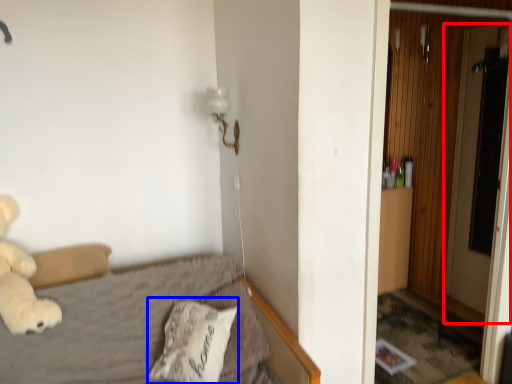
Question: Which object is further to the camera taking this photo, screen door (highlighted by a red box) or pillow (highlighted by a blue box)?

Choices:
 (A) screen door
 (B) pillow

Answer: (A)